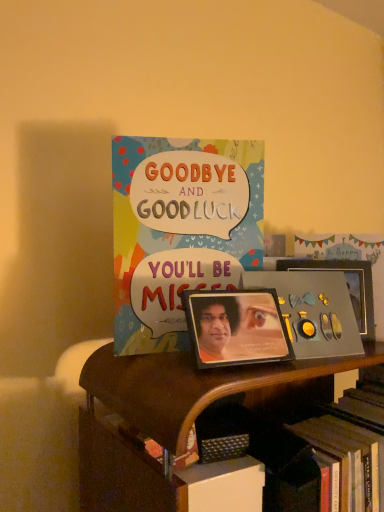
Locate an element on the screen. This screenshot has width=384, height=512. vacant area that is in front of colorful paper card at upper center is located at coordinates (195, 368).